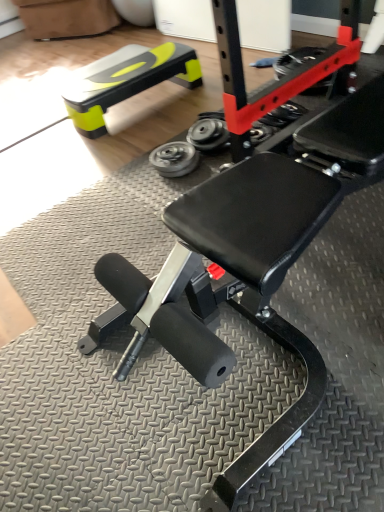
Where is `unoccupied region to the right of neon yellow plastic bench at upper left`? The width and height of the screenshot is (384, 512). unoccupied region to the right of neon yellow plastic bench at upper left is located at coordinates [206, 86].